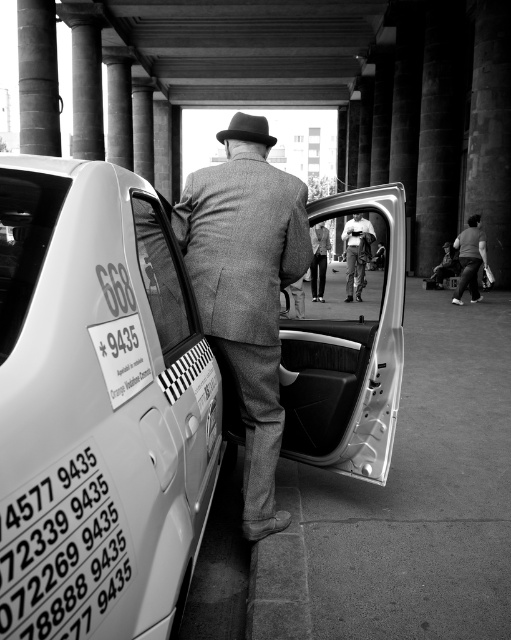
Consider the image. Is textured wool suit at center above light brown leather pants at center?

Incorrect, textured wool suit at center is not positioned above light brown leather pants at center.

Can you confirm if textured wool suit at center is wider than light brown leather pants at center?

Yes, textured wool suit at center is wider than light brown leather pants at center.

At what (x,y) coordinates should I click in order to perform the action: click on textured wool suit at center. Please return your answer as a coordinate pair (x, y). This screenshot has height=640, width=511. Looking at the image, I should click on (246, 296).

Does point (158, 582) come behind point (343, 449)?

No.

Is white glossy taxi at center-left further to the viewer compared to metallic silver car door at center?

No.

Which is in front, point (47, 262) or point (399, 262)?

Point (47, 262)

Where is `white glossy taxi at center-left`? The image size is (511, 640). white glossy taxi at center-left is located at coordinates (98, 406).

Describe the element at coordinates (374, 348) in the screenshot. This screenshot has height=640, width=511. I see `metallic silver car door at center` at that location.

Does metallic silver car door at center have a lesser width compared to matte gray fedora at center?

Yes.

Does point (387, 385) come farther from viewer compared to point (234, 132)?

Yes, it is behind point (234, 132).

Locate an element on the screen. This screenshot has height=640, width=511. metallic silver car door at center is located at coordinates (374, 348).